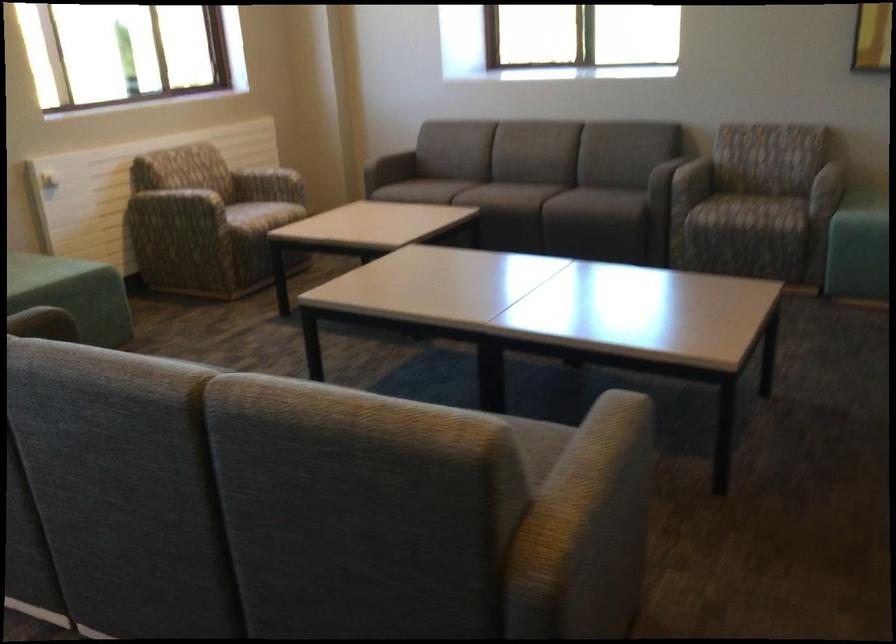
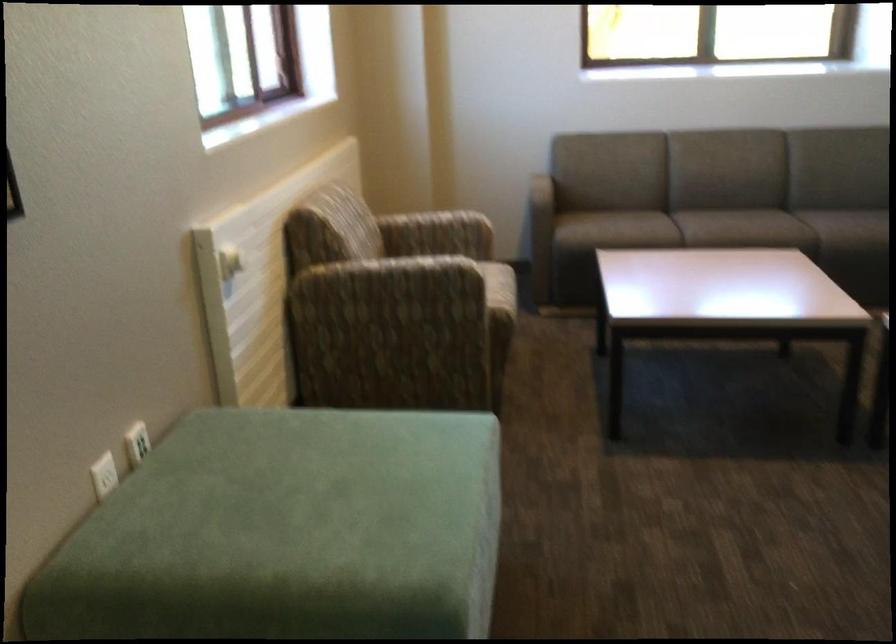
Where in the second image is the point corresponding to (506,193) from the first image?

(780, 229)